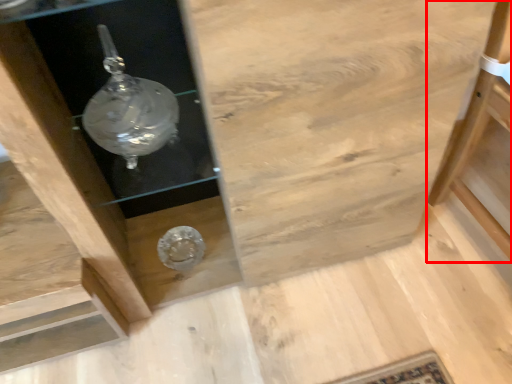
Question: Observing the image, what is the correct spatial positioning of furniture (annotated by the red box) in reference to cabinetry?

Choices:
 (A) right
 (B) left

Answer: (A)